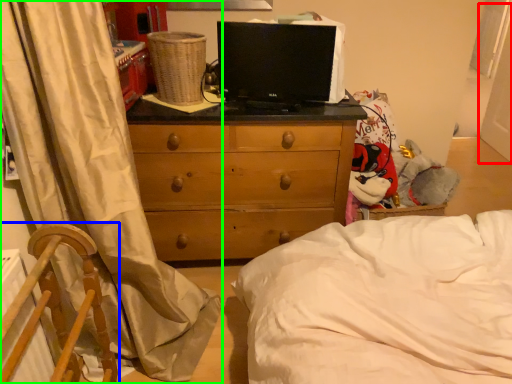
Question: Which is nearer to the screen door (highlighted by a red box)? furniture (highlighted by a blue box) or curtain (highlighted by a green box).

Choices:
 (A) furniture
 (B) curtain

Answer: (B)